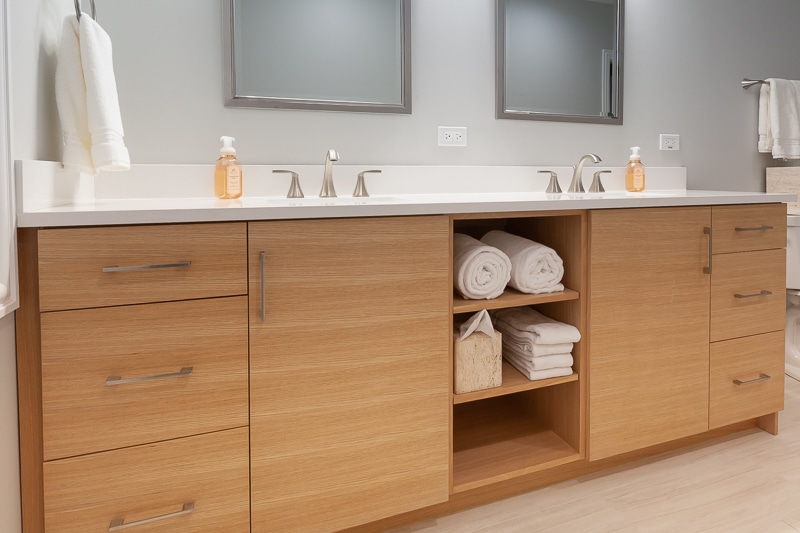
Where is `right mirror`? This screenshot has width=800, height=533. right mirror is located at coordinates (546, 64).